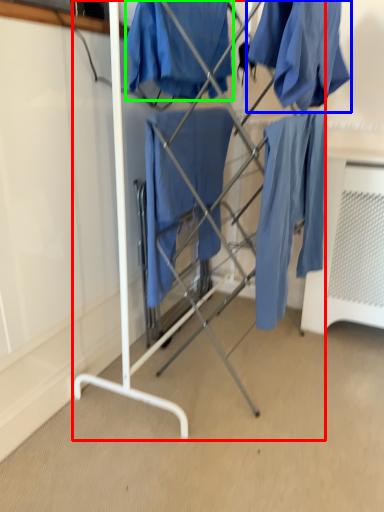
Question: Which object is the closest to the furniture (highlighted by a red box)? Choose among these: clothing (highlighted by a blue box) or clothing (highlighted by a green box).

Choices:
 (A) clothing
 (B) clothing

Answer: (B)